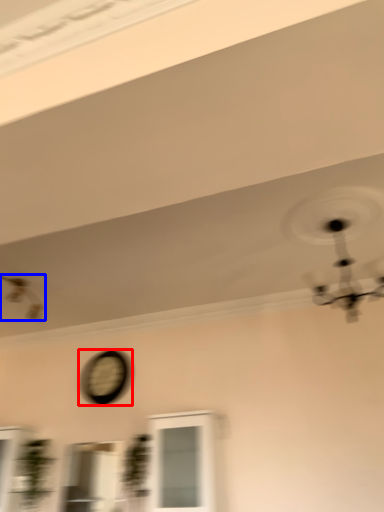
Question: Which object is further to the camera taking this photo, clock (highlighted by a red box) or mechanical fan (highlighted by a blue box)?

Choices:
 (A) clock
 (B) mechanical fan

Answer: (A)